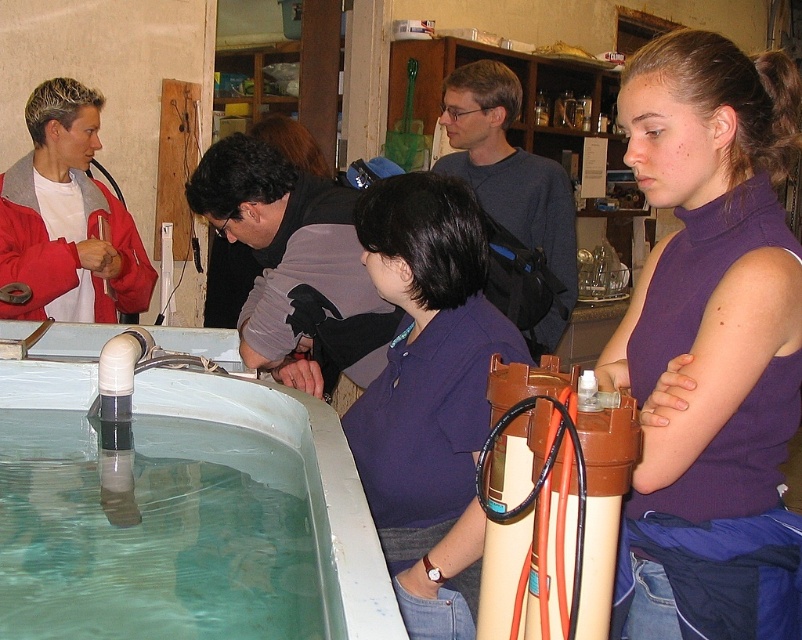
Looking at this image, which is more to the left, purple turtleneck at center or matte white shirt at upper left?

matte white shirt at upper left

Can you confirm if purple turtleneck at center is positioned to the right of matte white shirt at upper left?

Correct, you'll find purple turtleneck at center to the right of matte white shirt at upper left.

What are the coordinates of `purple turtleneck at center` in the screenshot? It's located at [711, 344].

Is purple cotton shirt at center thinner than matte white shirt at upper left?

Yes.

Based on the photo, is purple cotton shirt at center in front of matte white shirt at upper left?

Yes.

Who is more distant from viewer, (369, 237) or (59, 124)?

The point (59, 124) is behind.

Find the location of a particular element. The width and height of the screenshot is (802, 640). purple cotton shirt at center is located at coordinates (428, 396).

Between point (764, 595) and point (160, 369), which one is positioned in front?

Point (764, 595)

Is purple turtleneck at center to the right of white plastic tub at lower left from the viewer's perspective?

Correct, you'll find purple turtleneck at center to the right of white plastic tub at lower left.

Where is `purple turtleneck at center`? The image size is (802, 640). purple turtleneck at center is located at coordinates (711, 344).